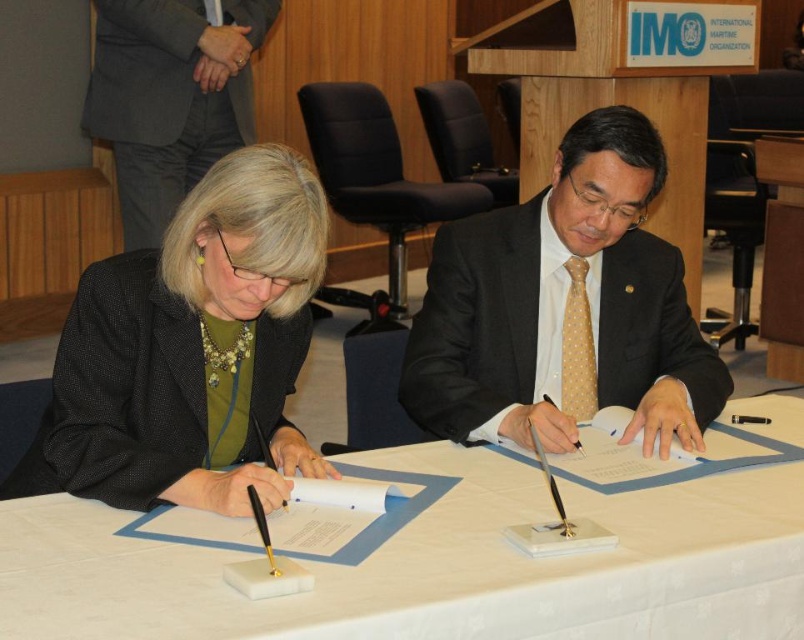
Is black fabric jacket at center further to the viewer compared to matte black suit at center?

That is False.

Which is behind, point (277, 372) or point (609, 260)?

Point (609, 260)

Locate an element on the screen. The image size is (804, 640). black fabric jacket at center is located at coordinates (189, 348).

I want to click on white paper at center, so click(435, 566).

Between white paper at center and black fabric jacket at center, which one is positioned lower?

white paper at center is below.

Locate an element on the screen. The width and height of the screenshot is (804, 640). white paper at center is located at coordinates (435, 566).

Is white paper at center shorter than matte black suit at center?

Yes.

Looking at this image, does white paper at center have a greater height compared to matte black suit at center?

No.

Who is more distant from viewer, (x=442, y=589) or (x=643, y=340)?

Point (x=643, y=340)

What are the coordinates of `white paper at center` in the screenshot? It's located at (435, 566).